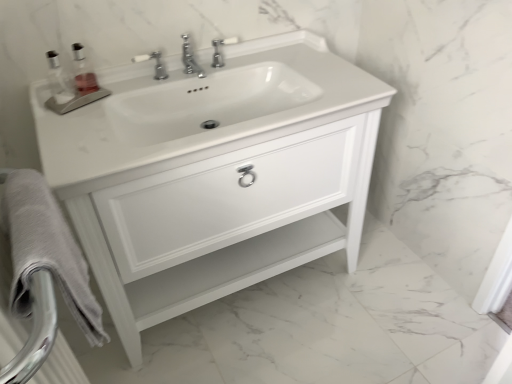
I want to click on vacant space to the left of clear glass soap dispenser at upper left, so click(58, 96).